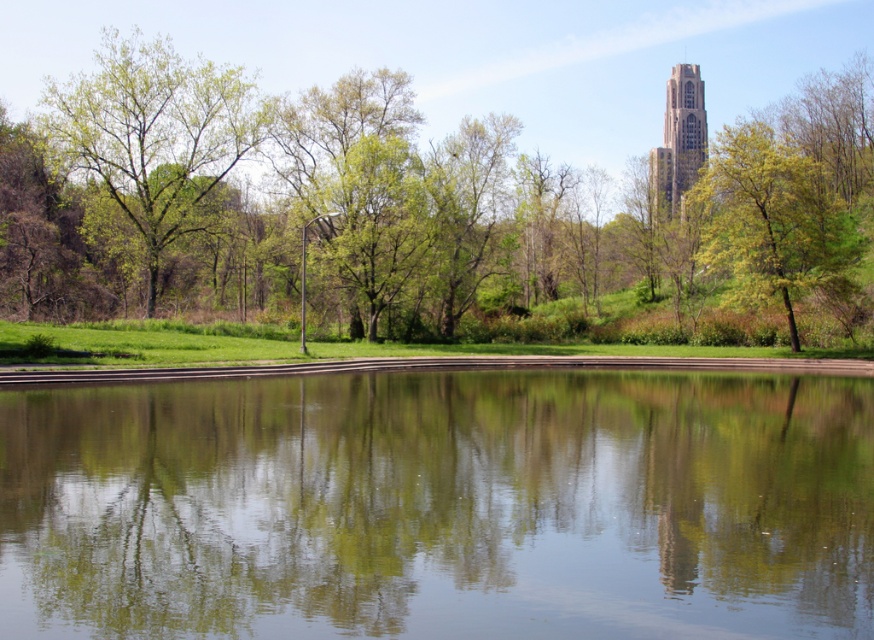
Question: Among these points, which one is farthest from the camera?

Choices:
 (A) (827, 225)
 (B) (597, 272)
 (C) (155, 518)
 (D) (136, 124)

Answer: (B)

Question: Can you confirm if green leafy tree at upper center is wider than green leafy tree at upper right?

Choices:
 (A) yes
 (B) no

Answer: (A)

Question: Among these points, which one is nearest to the camera?

Choices:
 (A) (826, 269)
 (B) (698, 99)
 (C) (214, 128)
 (D) (82, 86)

Answer: (A)

Question: Which is farther from the green leafy tree at upper center?

Choices:
 (A) transparent glass water at center
 (B) light brown stone tower at upper right
 (C) green leafy tree at upper right

Answer: (A)

Question: Is transparent glass water at center further to camera compared to green leafy tree at upper right?

Choices:
 (A) no
 (B) yes

Answer: (A)

Question: Where is green leafy tree at left located in relation to light brown stone tower at upper right in the image?

Choices:
 (A) right
 (B) left

Answer: (B)